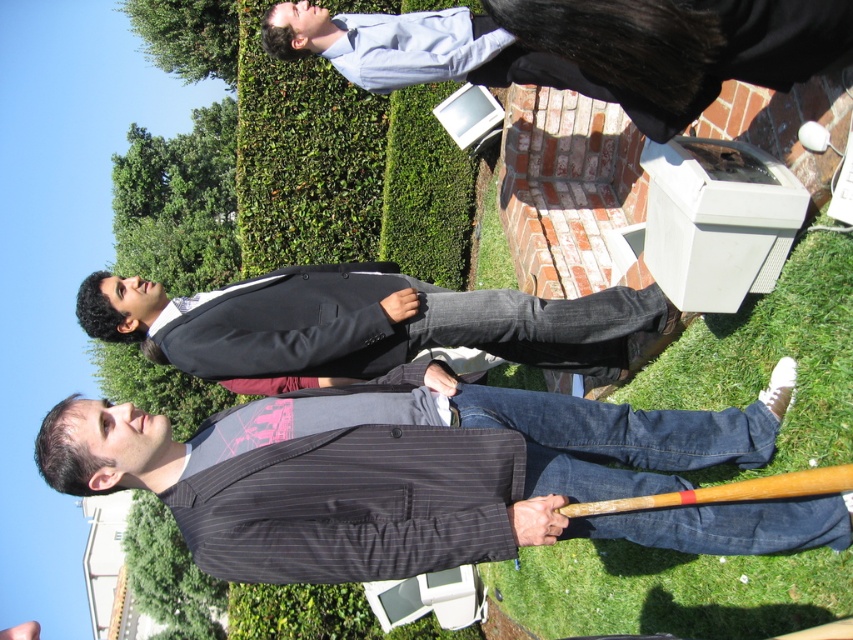
You are standing in the garden and want to place a small potted plant between the green grass at lower right and the light blue shirt at upper center. Which object should you place the plant closer to to ensure it is in the foreground?

The green grass at lower right is closer to the viewer than the light blue shirt at upper center. To place the plant in the foreground, position it closer to the green grass at lower right.

You are planning to wear a suit for an event and have two options in your closet. The striped pinstripe suit at center and the black pinstripe suit at center. Which one would be more suitable if you want to appear slimmer?

The striped pinstripe suit at center is thinner than the black pinstripe suit at center, so it would be more suitable if you want to appear slimmer.

You are a photographer trying to capture a group photo of the striped pinstripe suit at center and the black pinstripe suit at center. If you want to ensure both subjects are in focus, which one should you focus on first to account for their size difference?

The striped pinstripe suit at center is taller than the black pinstripe suit at center. To ensure both are in focus, focus on the striped pinstripe suit at center first since it is larger in the frame, then adjust for the smaller one.